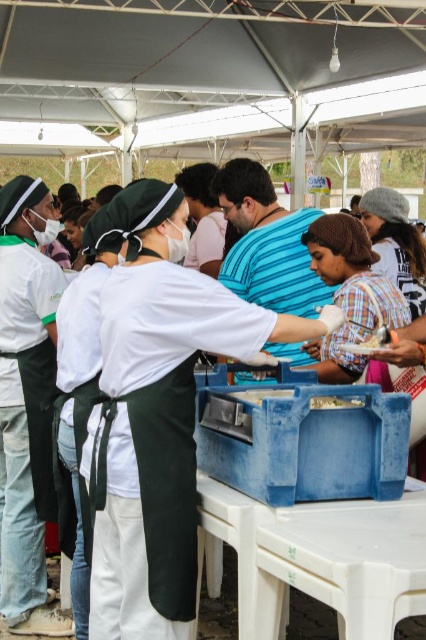
You are standing at the center of the canopy and want to locate the white fabric mask at left. In which direction should you look relative to your current position?

The white fabric mask at left is located at the lower left area of the image, so you should look to your left side to find it.

You are a photographer at the event and need to take a photo of the blue striped shirt at center and the smooth plastic container at center. Considering their sizes, which object should you focus on first to ensure it appears larger in the photo?

The blue striped shirt at center is much taller than the smooth plastic container at center, so you should focus on the blue striped shirt at center first to ensure it appears larger in the photo.